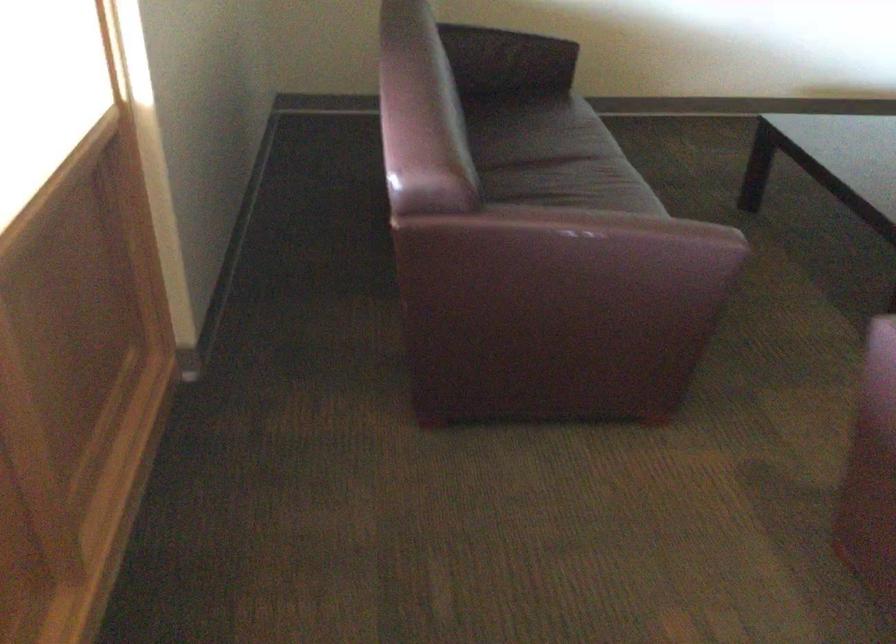
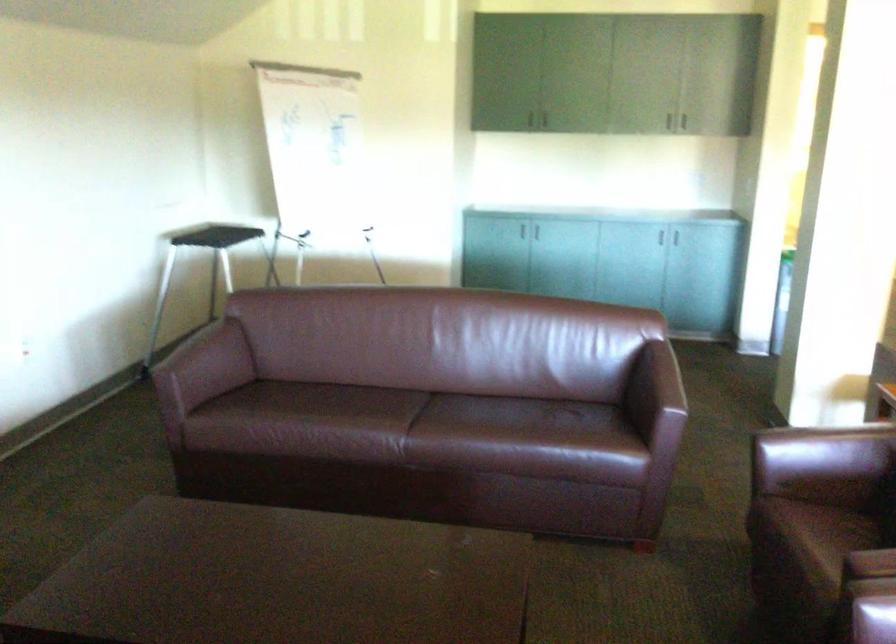
The first image is from the beginning of the video and the second image is from the end. How did the camera likely rotate when shooting the video?

The camera's rotation is toward right-down.